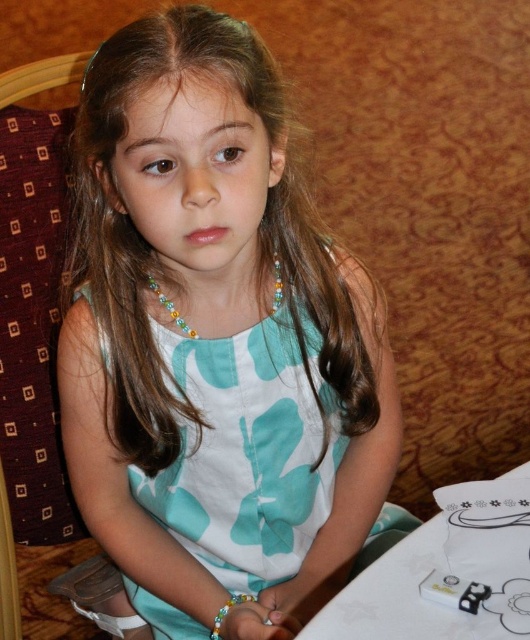
Who is higher up, white paper at lower right or multicolored beaded bracelet at lower center?

white paper at lower right is higher up.

Can you confirm if white paper at lower right is taller than multicolored beaded bracelet at lower center?

Yes, white paper at lower right is taller than multicolored beaded bracelet at lower center.

This screenshot has height=640, width=530. Describe the element at coordinates (445, 572) in the screenshot. I see `white paper at lower right` at that location.

Image resolution: width=530 pixels, height=640 pixels. Find the location of `white paper at lower right`. white paper at lower right is located at coordinates (445, 572).

Does white paper at lower right have a larger size compared to multicolored beaded necklace at center?

Indeed, white paper at lower right has a larger size compared to multicolored beaded necklace at center.

Between white paper at lower right and multicolored beaded necklace at center, which one appears on the left side from the viewer's perspective?

multicolored beaded necklace at center is more to the left.

Is point (449, 529) positioned in front of point (155, 288)?

Yes, it is in front of point (155, 288).

You are a GUI agent. You are given a task and a screenshot of the screen. Output one action in this format:
    pyautogui.click(x=<x>, y=<y>)
    Task: Click on the white paper at lower right
    
    Given the screenshot: What is the action you would take?
    pyautogui.click(x=445, y=572)

Can you confirm if matte teal dress at center is smaller than multicolored beaded bracelet at lower center?

Incorrect, matte teal dress at center is not smaller in size than multicolored beaded bracelet at lower center.

Looking at this image, is matte teal dress at center shorter than multicolored beaded bracelet at lower center?

No.

Does point (199, 173) lie behind point (223, 624)?

No, (199, 173) is closer to viewer.

Find the location of a particular element. The height and width of the screenshot is (640, 530). matte teal dress at center is located at coordinates pyautogui.click(x=216, y=342).